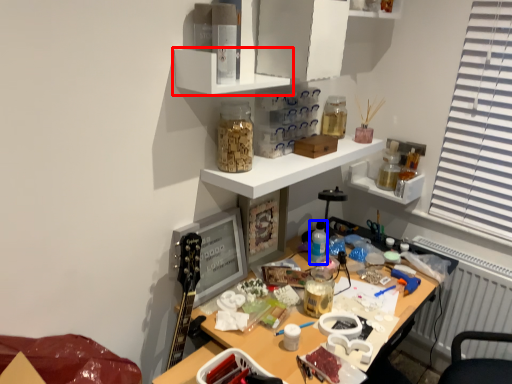
Question: Which of the following is the farthest to the observer, shelf (highlighted by a red box) or bottle (highlighted by a blue box)?

Choices:
 (A) shelf
 (B) bottle

Answer: (B)